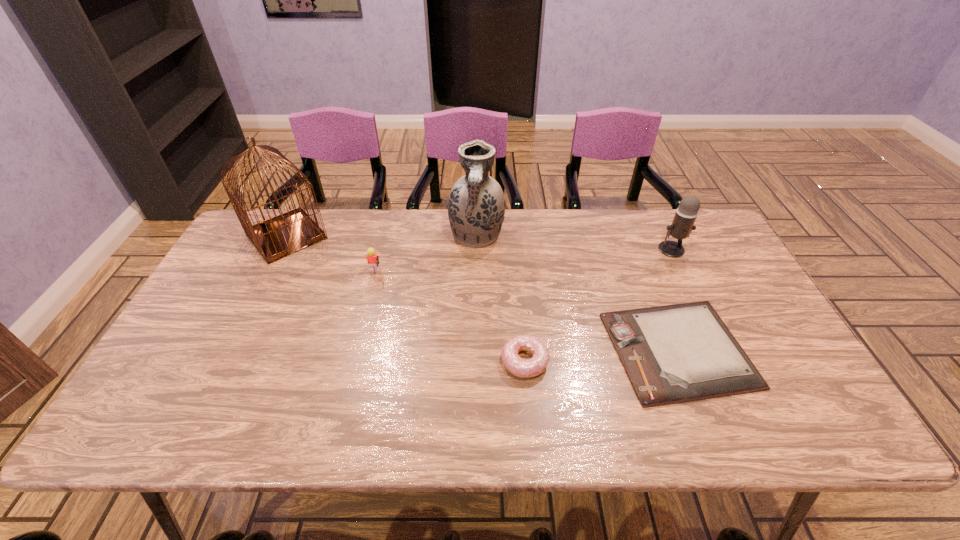
Image resolution: width=960 pixels, height=540 pixels. In order to click on vacant space that satisfies the following two spatial constraints: 1. with the handle on the side of the vase; 2. on the left side of the third tallest object in this screenshot , I will do `click(476, 249)`.

The width and height of the screenshot is (960, 540). In order to click on vacant position in the image that satisfies the following two spatial constraints: 1. with the handle on the side of the vase; 2. in front of the Lego with the accessory visible in this screenshot , I will do `click(476, 273)`.

Locate an element on the screen. The image size is (960, 540). free location that satisfies the following two spatial constraints: 1. with the handle on the side of the second shortest object; 2. on the left side of the vase is located at coordinates (475, 361).

Find the location of a particular element. This screenshot has height=540, width=960. vacant space that satisfies the following two spatial constraints: 1. with the handle on the side of the doughnut; 2. on the left side of the vase is located at coordinates (475, 361).

In order to click on vacant space that satisfies the following two spatial constraints: 1. in front of the Lego with the accessory visible; 2. on the right side of the clipboard in this screenshot , I will do `click(355, 350)`.

Image resolution: width=960 pixels, height=540 pixels. Identify the location of vacant region that satisfies the following two spatial constraints: 1. with the handle on the side of the vase; 2. in front of the Lego with the accessory visible. (476, 273).